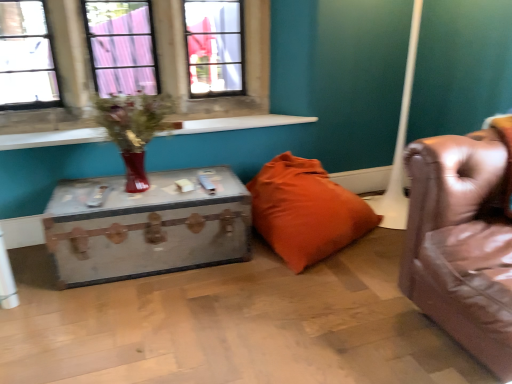
Question: Relative to white smooth window sill at upper left, is matte glass vase at upper left in front or behind?

Choices:
 (A) behind
 (B) front

Answer: (B)

Question: Is matte glass vase at upper left taller or shorter than white smooth window sill at upper left?

Choices:
 (A) short
 (B) tall

Answer: (B)

Question: Based on their relative distances, which object is nearer to the orange fabric pillow at center?

Choices:
 (A) rustic wood trunk at center
 (B) matte glass vase at upper left
 (C) white smooth window sill at upper left

Answer: (A)

Question: Estimate the real-world distances between objects in this image. Which object is farther from the white smooth window sill at upper left?

Choices:
 (A) orange fabric pillow at center
 (B) matte glass vase at upper left
 (C) rustic wood trunk at center

Answer: (C)